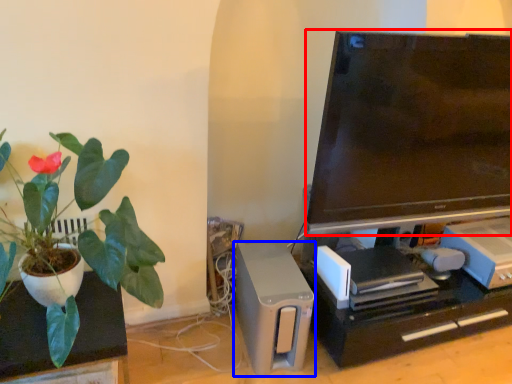
Question: Among these objects, which one is farthest to the camera, television (highlighted by a red box) or appliance (highlighted by a blue box)?

Choices:
 (A) television
 (B) appliance

Answer: (B)